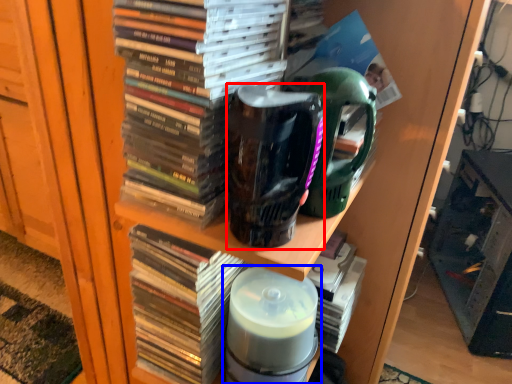
Question: Which object is further to the camera taking this photo, mug (highlighted by a red box) or bottle (highlighted by a blue box)?

Choices:
 (A) mug
 (B) bottle

Answer: (B)